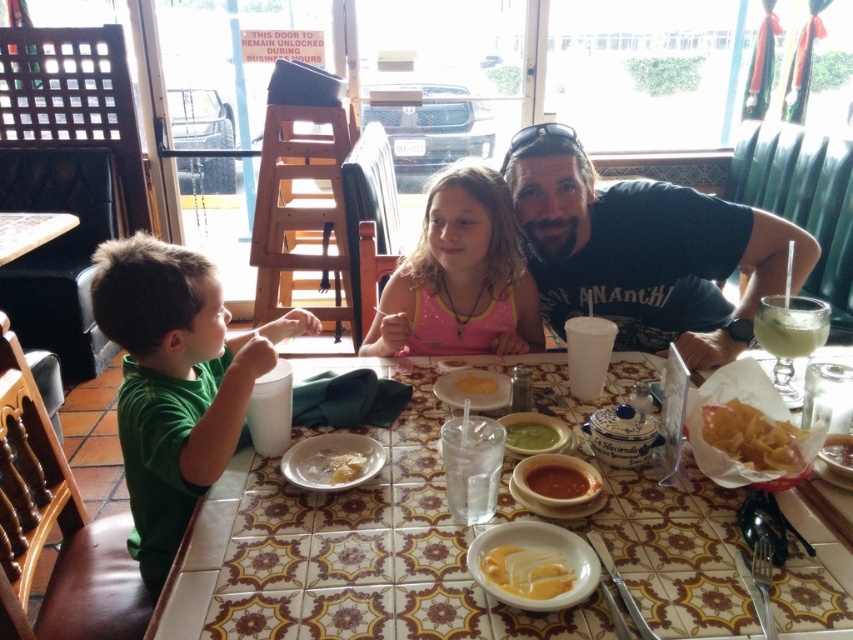
You are a server in a restaurant and need to determine which item on the table requires more space for serving. Based on the scene, which object between the green matte shirt at left and the white creamy soup at center takes up more space?

The green matte shirt at left has a larger size compared to the white creamy soup at center, so it requires more space for serving.